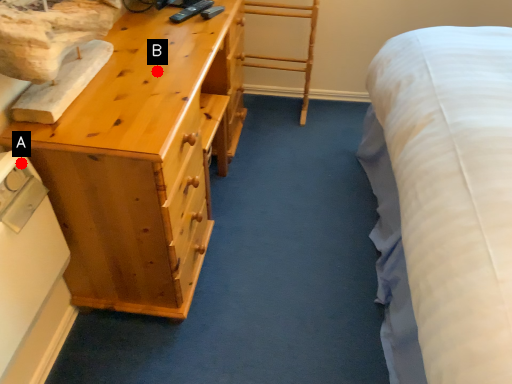
Question: Two points are circled on the image, labeled by A and B beside each circle. Which point appears closest to the camera in this image?

Choices:
 (A) A is closer
 (B) B is closer

Answer: (A)